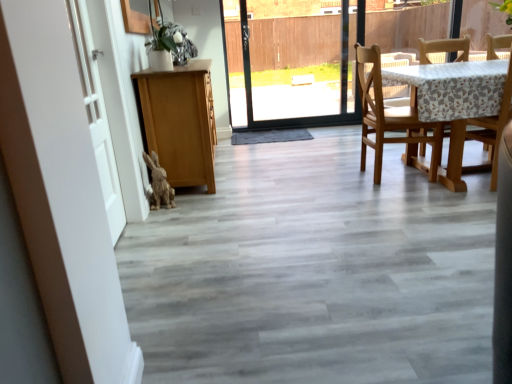
What is the approximate height of wooden chair at right, the 2th chair viewed from the left?

It is 38.70 inches.

The height and width of the screenshot is (384, 512). What do you see at coordinates (497, 44) in the screenshot? I see `wooden chair at right, the first chair in the right-to-left sequence` at bounding box center [497, 44].

Describe the element at coordinates (97, 115) in the screenshot. I see `white matte door at left` at that location.

Consider the image. In order to face white matte door at left, should I rotate leftwards or rightwards?

Rotate left and turn 20.656 degrees.

The height and width of the screenshot is (384, 512). I want to click on light brown wooden chair at right, which is the 2th chair from right to left, so click(390, 118).

You are a GUI agent. You are given a task and a screenshot of the screen. Output one action in this format:
    pyautogui.click(x=<x>, y=<y>)
    Task: Click on the white matte barn door at left
    
    Given the screenshot: What is the action you would take?
    pyautogui.click(x=61, y=195)

I want to click on wooden chair at right, the first chair in the right-to-left sequence, so click(497, 44).

In the scene shown: Which object is thinner, wooden chair at right, the first chair in the right-to-left sequence, or light brown wooden chair at right, which is the 1th chair in left-to-right order?

wooden chair at right, the first chair in the right-to-left sequence, is thinner.

Would you say wooden chair at right, the first chair in the right-to-left sequence, is a long distance from light brown wooden chair at right, which is the 1th chair in left-to-right order?

Yes, wooden chair at right, the first chair in the right-to-left sequence, and light brown wooden chair at right, which is the 1th chair in left-to-right order, are quite far apart.

Is light brown wooden chair at right, which is the 1th chair in left-to-right order, surrounded by wooden chair at right, the first chair in the right-to-left sequence?

No, light brown wooden chair at right, which is the 1th chair in left-to-right order, is not surrounded by wooden chair at right, the first chair in the right-to-left sequence.

How different are the orientations of wooden chair at right, the first chair in the right-to-left sequence, and light brown wooden chair at right, which is the 2th chair from right to left, in degrees?

The angular difference between wooden chair at right, the first chair in the right-to-left sequence, and light brown wooden chair at right, which is the 2th chair from right to left, is 90 degrees.

Between light brown wooden chair at right, which is the 1th chair in left-to-right order, and fuzzy brown rabbit at lower left, which one has larger size?

With larger size is light brown wooden chair at right, which is the 1th chair in left-to-right order.

Who is shorter, light brown wooden chair at right, which is the 2th chair from right to left, or fuzzy brown rabbit at lower left?

fuzzy brown rabbit at lower left.

The width and height of the screenshot is (512, 384). I want to click on animal that is under the light brown wooden chair at right, which is the 1th chair in left-to-right order (from a real-world perspective), so click(x=159, y=183).

Considering the relative positions of white matte barn door at left and light brown wooden chair at right, which is the 1th chair in left-to-right order, in the image provided, is white matte barn door at left to the left of light brown wooden chair at right, which is the 1th chair in left-to-right order, from the viewer's perspective?

Indeed, white matte barn door at left is positioned on the left side of light brown wooden chair at right, which is the 1th chair in left-to-right order.

From a real-world perspective, is white matte barn door at left positioned over light brown wooden chair at right, which is the 2th chair from right to left, based on gravity?

Yes, from a real-world perspective, white matte barn door at left is above light brown wooden chair at right, which is the 2th chair from right to left.

From the image's perspective, is white matte barn door at left above or below light brown wooden chair at right, which is the 1th chair in left-to-right order?

white matte barn door at left is below light brown wooden chair at right, which is the 1th chair in left-to-right order.

From the picture: Does white matte barn door at left have a greater height compared to light brown wooden chair at right, which is the 1th chair in left-to-right order?

Yes, white matte barn door at left is taller than light brown wooden chair at right, which is the 1th chair in left-to-right order.

Who is taller, white matte barn door at left or wooden chair at right, the 2th chair viewed from the left?

white matte barn door at left.

Based on their sizes in the image, would you say white matte barn door at left is bigger or smaller than wooden chair at right, the first chair in the right-to-left sequence?

In the image, white matte barn door at left appears to be larger than wooden chair at right, the first chair in the right-to-left sequence.

From a real-world perspective, which object stands above the other?

white matte barn door at left.

In order to click on the 1st chair above the white matte door at left (from the image's perspective) in this screenshot , I will do `click(497, 44)`.

Considering the relative sizes of white matte door at left and wooden chair at right, the first chair in the right-to-left sequence, in the image provided, is white matte door at left shorter than wooden chair at right, the first chair in the right-to-left sequence,?

No.

Can you confirm if white matte door at left is positioned to the right of wooden chair at right, the first chair in the right-to-left sequence?

In fact, white matte door at left is to the left of wooden chair at right, the first chair in the right-to-left sequence.

From the image's perspective, is white matte door at left located above or below white matte barn door at left?

From the image's perspective, white matte door at left appears above white matte barn door at left.

From a real-world perspective, is white matte door at left located beneath white matte barn door at left?

Yes, from a real-world perspective, white matte door at left is beneath white matte barn door at left.

Is white matte door at left completely or partially outside of white matte barn door at left?

Actually, white matte door at left is within white matte barn door at left.

The height and width of the screenshot is (384, 512). I want to click on door behind the white matte barn door at left, so click(97, 115).

Is point (436, 164) farther from camera compared to point (106, 174)?

Yes, point (436, 164) is behind point (106, 174).

Which of these two, light brown wooden chair at right, which is the 2th chair from right to left, or white matte door at left, stands shorter?

light brown wooden chair at right, which is the 2th chair from right to left, is shorter.

Would you say light brown wooden chair at right, which is the 2th chair from right to left, contains white matte door at left?

Actually, white matte door at left is outside light brown wooden chair at right, which is the 2th chair from right to left.

Based on the photo, from a real-world perspective, does light brown wooden chair at right, which is the 1th chair in left-to-right order, stand above white matte door at left?

No, from a real-world perspective, light brown wooden chair at right, which is the 1th chair in left-to-right order, is not on top of white matte door at left.

Where is `chair lying below the light brown wooden chair at right, which is the 1th chair in left-to-right order (from the image's perspective)`? chair lying below the light brown wooden chair at right, which is the 1th chair in left-to-right order (from the image's perspective) is located at coordinates (497, 44).

You are a GUI agent. You are given a task and a screenshot of the screen. Output one action in this format:
    pyautogui.click(x=<x>, y=<y>)
    Task: Click on the chair that is the 2nd object located above the fuzzy brown rabbit at lower left (from the image's perspective)
    Image resolution: width=512 pixels, height=384 pixels.
    Given the screenshot: What is the action you would take?
    pyautogui.click(x=390, y=118)

In the scene shown: Which object lies further to the anchor point light brown wooden chair at right, which is the 1th chair in left-to-right order, white matte door at left or fuzzy brown rabbit at lower left?

The object further to light brown wooden chair at right, which is the 1th chair in left-to-right order, is white matte door at left.

Estimate the real-world distances between objects in this image. Which object is further from white matte door at left, wooden chair at right, the first chair in the right-to-left sequence, or white matte barn door at left?

wooden chair at right, the first chair in the right-to-left sequence, lies further to white matte door at left than the other object.

Looking at the image, which one is located further to fuzzy brown rabbit at lower left, wooden chair at right, the 2th chair viewed from the left, or light brown wooden chair at right, which is the 1th chair in left-to-right order?

The object further to fuzzy brown rabbit at lower left is wooden chair at right, the 2th chair viewed from the left.

Based on their spatial positions, is wooden chair at right, the 2th chair viewed from the left, or fuzzy brown rabbit at lower left further from light brown wooden chair at right, which is the 2th chair from right to left?

fuzzy brown rabbit at lower left.

Which object lies nearer to the anchor point light brown wooden chair at right, which is the 1th chair in left-to-right order, fuzzy brown rabbit at lower left or white matte barn door at left?

The object closer to light brown wooden chair at right, which is the 1th chair in left-to-right order, is fuzzy brown rabbit at lower left.

Based on their spatial positions, is white matte barn door at left or fuzzy brown rabbit at lower left further from light brown wooden chair at right, which is the 2th chair from right to left?

white matte barn door at left is further to light brown wooden chair at right, which is the 2th chair from right to left.

In the scene shown: Considering their positions, is light brown wooden chair at right, which is the 2th chair from right to left, positioned further to white matte door at left than fuzzy brown rabbit at lower left?

light brown wooden chair at right, which is the 2th chair from right to left.

From the picture: When comparing their distances from fuzzy brown rabbit at lower left, does white matte door at left or wooden chair at right, the 2th chair viewed from the left, seem further?

wooden chair at right, the 2th chair viewed from the left, is further to fuzzy brown rabbit at lower left.

This screenshot has height=384, width=512. Identify the location of barn door located between white matte door at left and light brown wooden chair at right, which is the 2th chair from right to left, in the left-right direction. (61, 195).

Identify the location of animal between white matte door at left and light brown wooden chair at right, which is the 2th chair from right to left, from left to right. (159, 183).

The image size is (512, 384). Identify the location of animal situated between white matte door at left and wooden chair at right, the 2th chair viewed from the left, from left to right. (159, 183).

Where is `barn door between white matte door at left and wooden chair at right, the 2th chair viewed from the left, from left to right`? barn door between white matte door at left and wooden chair at right, the 2th chair viewed from the left, from left to right is located at coordinates coord(61,195).